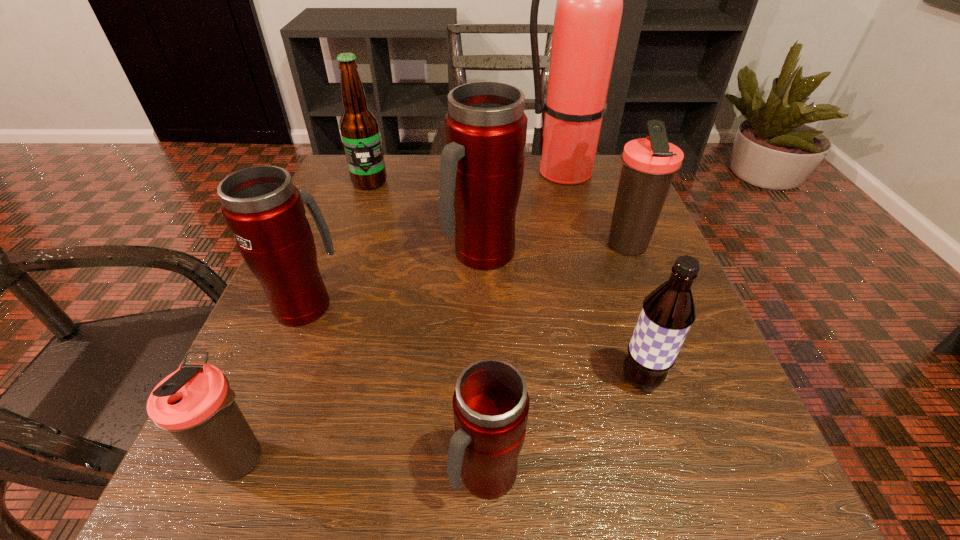
Where is `the tallest object`? the tallest object is located at coordinates (588, 13).

Where is `the tallest thermos bottle`? Image resolution: width=960 pixels, height=540 pixels. the tallest thermos bottle is located at coordinates (482, 165).

Identify the location of the farthest red thermos bottle. (482, 165).

At what (x,y) coordinates should I click in order to perform the action: click on brown beer bottle. Please return your answer as a coordinate pair (x, y). Image resolution: width=960 pixels, height=540 pixels. Looking at the image, I should click on (359, 127).

The height and width of the screenshot is (540, 960). Identify the location of the rightmost thermos bottle. (649, 164).

Find the location of a particular element. Image resolution: width=960 pixels, height=540 pixels. the bigger brown thermos bottle is located at coordinates (649, 164).

In order to click on the fifth farthest object in this screenshot , I will do `click(264, 210)`.

Locate an element on the screen. This screenshot has height=540, width=960. the second biggest red thermos bottle is located at coordinates (264, 210).

Identify the location of brown root beer. (668, 312).

Identify the location of the third nearest object. (668, 312).